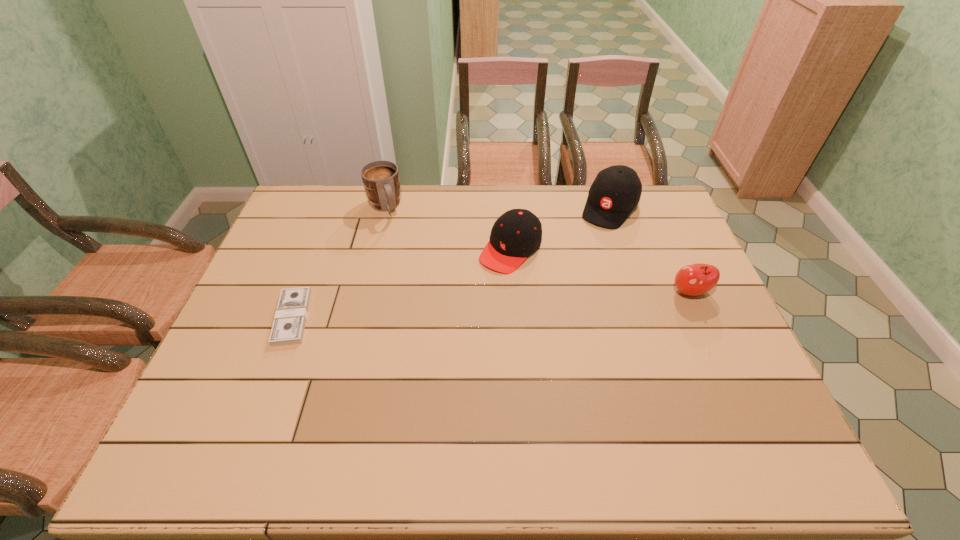
At what (x,y) coordinates should I click in order to perform the action: click on free region that satisfies the following two spatial constraints: 1. on the back side of the baseball cap; 2. on the right side of the leftmost object. Please return your answer as a coordinate pair (x, y). Looking at the image, I should click on (334, 207).

I want to click on blank space that satisfies the following two spatial constraints: 1. on the back side of the baseball cap; 2. on the left side of the cap, so click(508, 207).

Find the location of `free spot that satisfies the following two spatial constraints: 1. on the back side of the dollar; 2. on the left side of the baseball cap`. free spot that satisfies the following two spatial constraints: 1. on the back side of the dollar; 2. on the left side of the baseball cap is located at coordinates (334, 207).